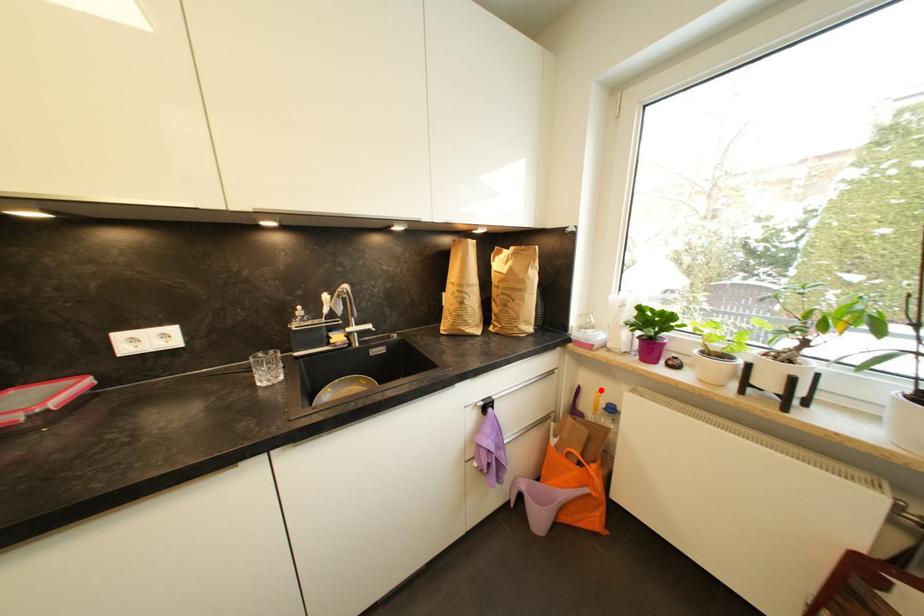
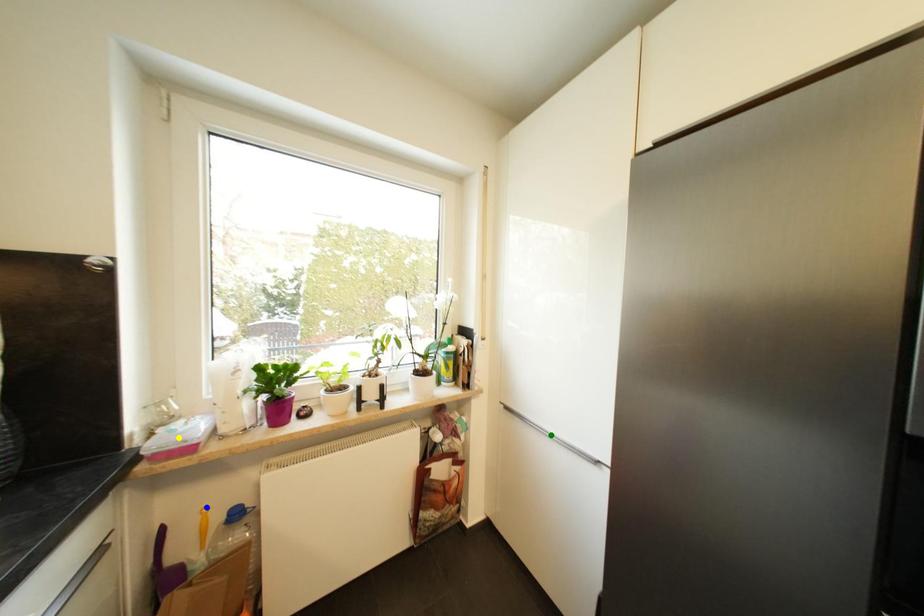
Question: I am providing you with two images of the same scene from different viewpoints. A red point is marked on the first image. You are given multiple points on the second image. Can you choose the point in image 2 that corresponds to the point in image 1?

Choices:
 (A) green point
 (B) yellow point
 (C) blue point

Answer: (C)